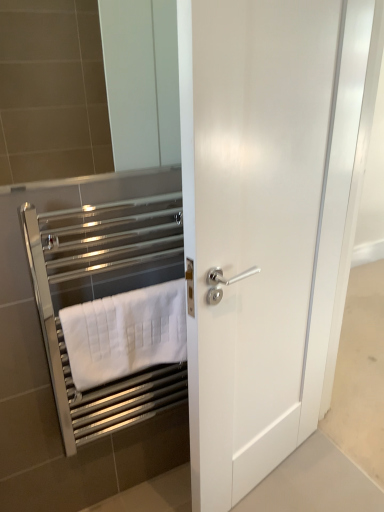
Question: Would you consider white matte towel at left to be distant from white glossy door at center?

Choices:
 (A) yes
 (B) no

Answer: (B)

Question: From the image's perspective, is white matte towel at left on white glossy door at center?

Choices:
 (A) yes
 (B) no

Answer: (B)

Question: Does white matte towel at left have a smaller size compared to white glossy door at center?

Choices:
 (A) no
 (B) yes

Answer: (B)

Question: Is white matte towel at left closer to the viewer compared to white glossy door at center?

Choices:
 (A) no
 (B) yes

Answer: (A)

Question: Is white matte towel at left shorter than white glossy door at center?

Choices:
 (A) yes
 (B) no

Answer: (A)

Question: In the image, is white matte towel at left positioned in front of or behind chrome metallic towel rack at left?

Choices:
 (A) front
 (B) behind

Answer: (B)

Question: In terms of width, does white matte towel at left look wider or thinner when compared to chrome metallic towel rack at left?

Choices:
 (A) wide
 (B) thin

Answer: (B)

Question: From the image's perspective, is white matte towel at left positioned above or below chrome metallic towel rack at left?

Choices:
 (A) above
 (B) below

Answer: (B)

Question: From a real-world perspective, is white matte towel at left above or below chrome metallic towel rack at left?

Choices:
 (A) below
 (B) above

Answer: (A)

Question: Considering the positions of white glossy door at center and chrome metallic towel rack at left in the image, is white glossy door at center wider or thinner than chrome metallic towel rack at left?

Choices:
 (A) wide
 (B) thin

Answer: (A)

Question: From a real-world perspective, is white glossy door at center above or below chrome metallic towel rack at left?

Choices:
 (A) below
 (B) above

Answer: (B)

Question: Based on their sizes in the image, would you say white glossy door at center is bigger or smaller than chrome metallic towel rack at left?

Choices:
 (A) small
 (B) big

Answer: (B)

Question: Choose the correct answer: Is white glossy door at center inside chrome metallic towel rack at left or outside it?

Choices:
 (A) outside
 (B) inside

Answer: (A)

Question: Is chrome metallic towel rack at left bigger or smaller than white matte towel at left?

Choices:
 (A) small
 (B) big

Answer: (B)

Question: Is point [x=61, y=410] closer or farther from the camera than point [x=134, y=356]?

Choices:
 (A) closer
 (B) farther

Answer: (B)